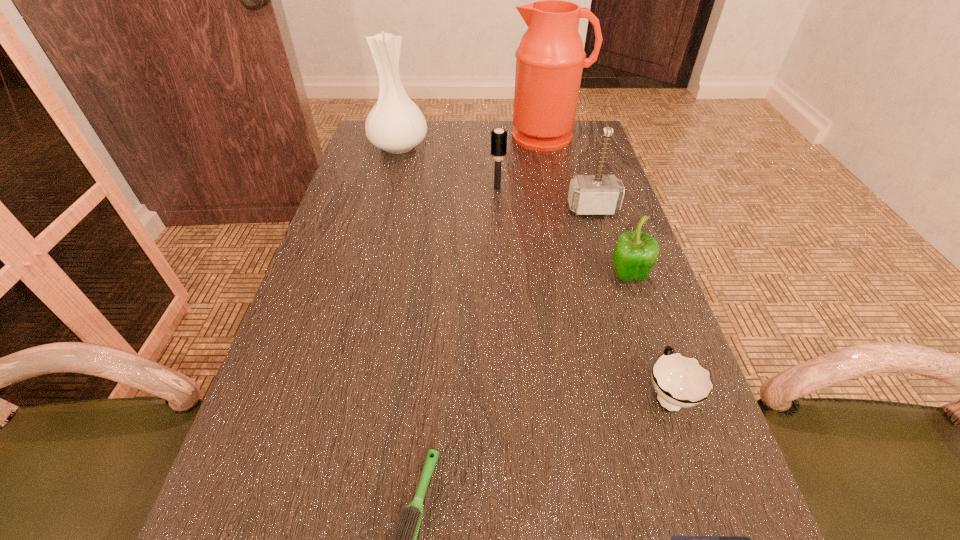
Where is `the sixth farthest object`? the sixth farthest object is located at coordinates (680, 382).

At what (x,y) coordinates should I click in order to perform the action: click on vacant space located 0.220m from the spout of the tallest object. Please return your answer as a coordinate pair (x, y). Looking at the image, I should click on (560, 193).

Image resolution: width=960 pixels, height=540 pixels. I want to click on vacant space located 0.090m on the front of the second tallest object, so click(391, 178).

Image resolution: width=960 pixels, height=540 pixels. In order to click on vacant space located for striking with the head of the third tallest object in this screenshot , I will do pos(623,309).

Find the location of a particular element. This screenshot has width=960, height=540. free point located on the back of the sixth nearest object is located at coordinates (494, 134).

The width and height of the screenshot is (960, 540). I want to click on vacant space located 0.160m on the left of the fourth nearest object, so click(x=535, y=277).

Image resolution: width=960 pixels, height=540 pixels. I want to click on free location located 0.110m on the side of the cup with the handle, so click(642, 320).

At what (x,y) coordinates should I click in order to perform the action: click on vacant area located 0.340m on the side of the cup with the handle. Please return your answer as a coordinate pair (x, y). Image resolution: width=960 pixels, height=540 pixels. Looking at the image, I should click on (617, 245).

Identify the location of vacant space located 0.170m on the side of the cup with the handle. (635, 298).

Where is `water jug present at the far edge`? The image size is (960, 540). water jug present at the far edge is located at coordinates (550, 59).